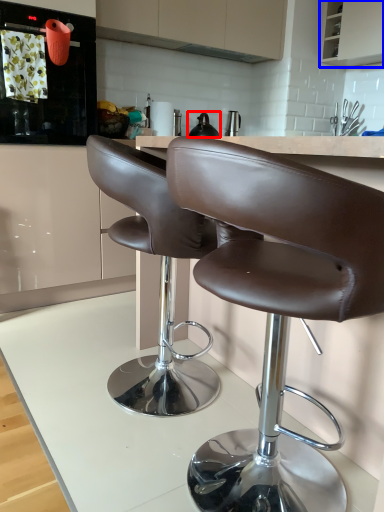
Question: Which of the following is the closest to the observer, tea pot (highlighted by a red box) or cabinetry (highlighted by a blue box)?

Choices:
 (A) tea pot
 (B) cabinetry

Answer: (A)